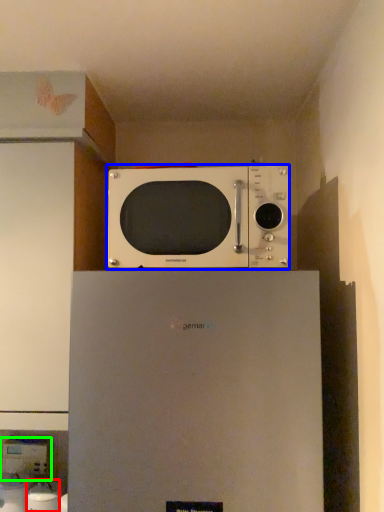
Question: Based on their relative distances, which object is nearer to appliance (highlighted by a red box)? Choose from microwave oven (highlighted by a blue box) and appliance (highlighted by a green box).

Choices:
 (A) microwave oven
 (B) appliance

Answer: (B)